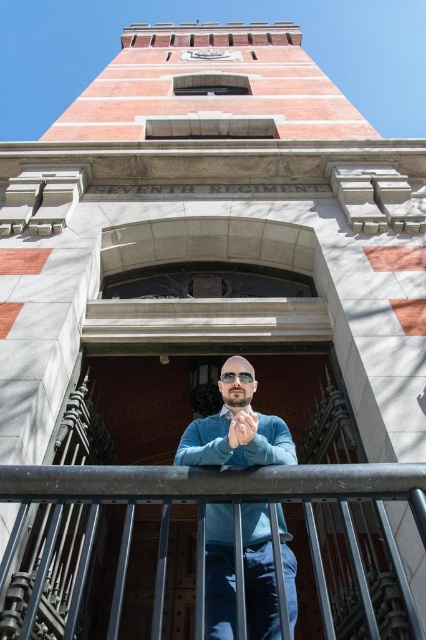
Between metallic steel balustrade at lower center and clear plastic goggles at center, which one appears on the right side from the viewer's perspective?

clear plastic goggles at center

Is point (158, 572) closer to camera compared to point (253, 378)?

Yes, point (158, 572) is closer to viewer.

Which is behind, point (350, 632) or point (219, 374)?

The point (219, 374) is behind.

This screenshot has width=426, height=640. In order to click on metallic steel balustrade at lower center in this screenshot , I will do `click(204, 540)`.

Is point (210, 577) behind point (236, 433)?

Yes, it is.

Who is positioned more to the left, blue sweater at center or matte blue hand at center?

From the viewer's perspective, matte blue hand at center appears more on the left side.

What do you see at coordinates (227, 435) in the screenshot? I see `blue sweater at center` at bounding box center [227, 435].

You are a GUI agent. You are given a task and a screenshot of the screen. Output one action in this format:
    pyautogui.click(x=<x>, y=<y>)
    Task: Click on the blue sweater at center
    
    Given the screenshot: What is the action you would take?
    pyautogui.click(x=227, y=435)

Can you confirm if matte blue hand at center is taller than clear plastic goggles at center?

Yes, matte blue hand at center is taller than clear plastic goggles at center.

Based on the photo, which of these two, matte blue hand at center or clear plastic goggles at center, stands taller?

matte blue hand at center is taller.

Is point (244, 422) farther from viewer compared to point (236, 378)?

No, it is not.

This screenshot has width=426, height=640. Find the location of `matte blue hand at center`. matte blue hand at center is located at coordinates (241, 428).